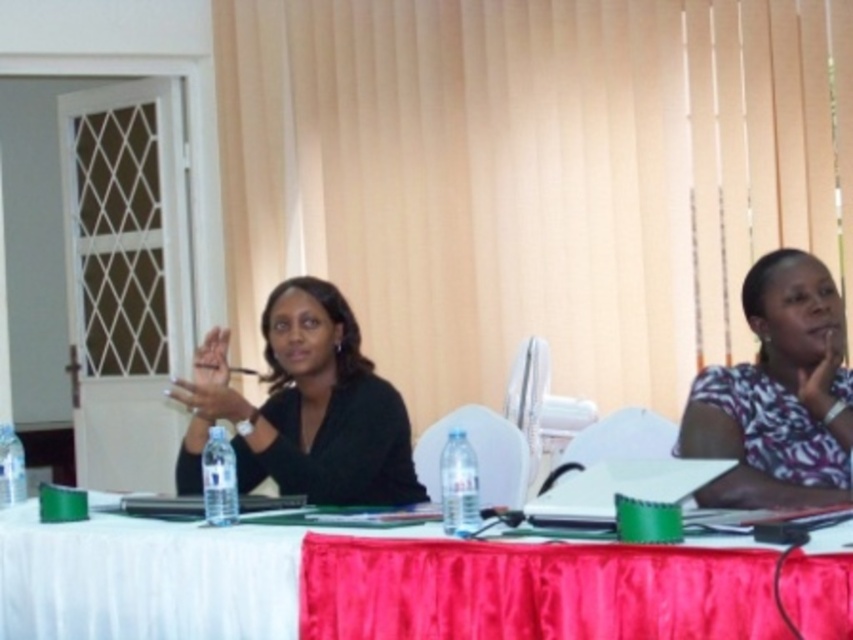
In the scene shown: Who is more forward, [164,595] or [277,465]?

Point [164,595]

Is point (285, 636) closer to camera compared to point (276, 387)?

Yes.

Where is `white fabric table at center`? The width and height of the screenshot is (853, 640). white fabric table at center is located at coordinates [x=144, y=579].

In the scene shown: Between white fabric table at center and printed cotton shirt at right, which one is positioned higher?

Positioned higher is printed cotton shirt at right.

Does white fabric table at center lie behind printed cotton shirt at right?

No, it is in front of printed cotton shirt at right.

Is point (50, 579) less distant than point (763, 358)?

Yes, it is.

In order to click on white fabric table at center in this screenshot , I will do `click(144, 579)`.

Consider the image. Is black matte shirt at center behind printed cotton shirt at right?

Yes, black matte shirt at center is further from the viewer.

Does black matte shirt at center appear under printed cotton shirt at right?

Indeed, black matte shirt at center is positioned under printed cotton shirt at right.

The image size is (853, 640). In order to click on black matte shirt at center in this screenshot , I will do coord(305,406).

Find the location of `black matte shirt at center`. black matte shirt at center is located at coordinates (305, 406).